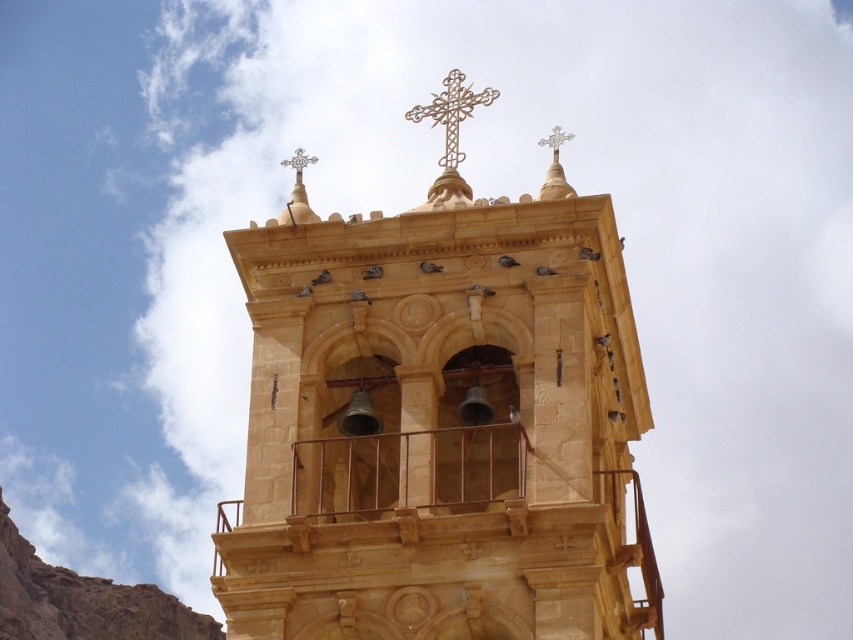
Question: Which object is the closest to the metallic cross at upper center?

Choices:
 (A) silver metallic cross at upper center
 (B) gold textured cross at upper center
 (C) golden stone church at center

Answer: (B)

Question: Considering the relative positions of gold textured cross at upper center and silver metallic cross at upper center in the image provided, where is gold textured cross at upper center located with respect to silver metallic cross at upper center?

Choices:
 (A) right
 (B) left

Answer: (B)

Question: Which point is farther from the camera taking this photo?

Choices:
 (A) click(340, 360)
 (B) click(553, 136)
 (C) click(416, 122)

Answer: (C)

Question: Can you confirm if metallic cross at upper center is positioned to the left of silver metallic cross at upper center?

Choices:
 (A) no
 (B) yes

Answer: (B)

Question: Estimate the real-world distances between objects in this image. Which object is closer to the gold textured cross at upper center?

Choices:
 (A) silver metallic cross at upper center
 (B) metallic cross at upper center

Answer: (A)

Question: Is gold textured cross at upper center bigger than silver metallic cross at upper center?

Choices:
 (A) yes
 (B) no

Answer: (A)